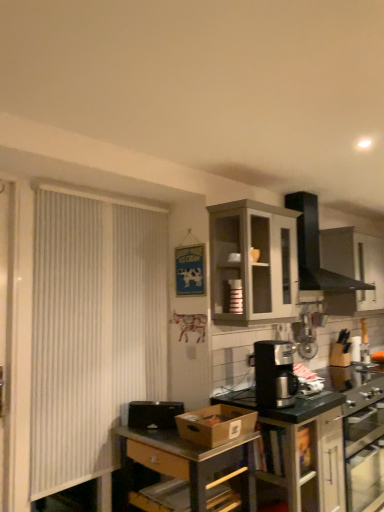
Find the location of `vacant area on top of black matte vent at upper center (from a real-world perspective)`. vacant area on top of black matte vent at upper center (from a real-world perspective) is located at coordinates (331, 191).